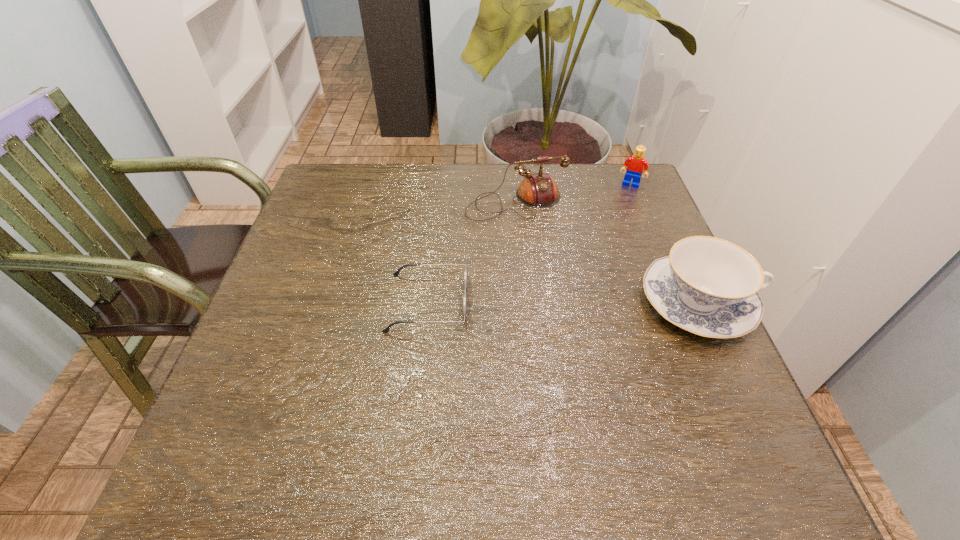
At what (x,y) coordinates should I click in order to perform the action: click on sunglasses. Please return your answer as a coordinate pair (x, y). The image size is (960, 540). Looking at the image, I should click on pos(396,273).

You are a GUI agent. You are given a task and a screenshot of the screen. Output one action in this format:
    pyautogui.click(x=<x>, y=<y>)
    Task: Click on the chinaware
    
    Given the screenshot: What is the action you would take?
    pyautogui.click(x=708, y=286)

You are a GUI agent. You are given a task and a screenshot of the screen. Output one action in this format:
    pyautogui.click(x=<x>, y=<y>)
    Task: Click on the telephone
    The image size is (960, 540).
    Given the screenshot: What is the action you would take?
    pyautogui.click(x=538, y=190)

Where is `Lego`? Lego is located at coordinates (636, 164).

What are the coordinates of `vacant position located 0.260m on the front-facing side of the shortest object` in the screenshot? It's located at pyautogui.click(x=590, y=302).

This screenshot has height=540, width=960. I want to click on vacant space located 0.350m on the rotary dial of the telephone, so click(x=584, y=330).

The width and height of the screenshot is (960, 540). What are the coordinates of `vacant space located 0.060m on the rotary dial of the telephone` in the screenshot? It's located at (538, 238).

At what (x,y) coordinates should I click in order to perform the action: click on free location located 0.230m on the rotary dial of the telephone. Please return your answer as a coordinate pair (x, y). The image size is (960, 540). Looking at the image, I should click on (x=563, y=287).

Find the location of `blank area located on the front-facing side of the Lego`. blank area located on the front-facing side of the Lego is located at coordinates (621, 205).

You are a GUI agent. You are given a task and a screenshot of the screen. Output one action in this format:
    pyautogui.click(x=<x>, y=<y>)
    Task: Click on the vacant position located on the front-facing side of the Lego
    
    Given the screenshot: What is the action you would take?
    pyautogui.click(x=591, y=285)